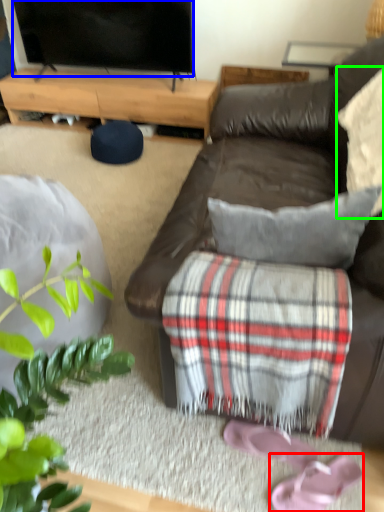
Question: Which is farther away from footwear (highlighted by a red box)? television (highlighted by a blue box) or pillow (highlighted by a green box)?

Choices:
 (A) television
 (B) pillow

Answer: (A)